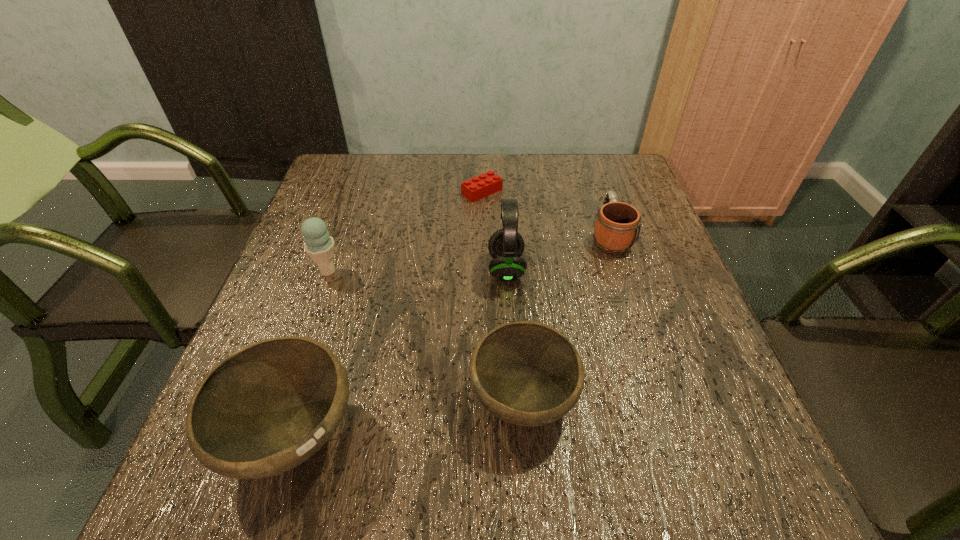
This screenshot has width=960, height=540. Find the location of `the left bowl`. the left bowl is located at coordinates (263, 410).

I want to click on the fourth tallest object, so click(x=526, y=373).

Locate an element on the screen. This screenshot has height=540, width=960. the right bowl is located at coordinates (526, 373).

The height and width of the screenshot is (540, 960). Find the location of `the shortest object`. the shortest object is located at coordinates (481, 186).

I want to click on the farthest object, so click(x=481, y=186).

The width and height of the screenshot is (960, 540). What are the coordinates of `ice cream` in the screenshot? It's located at (319, 245).

The height and width of the screenshot is (540, 960). I want to click on mug, so click(617, 226).

Identify the location of the rightmost object. The image size is (960, 540). (617, 226).

Identify the location of the tallest object. This screenshot has height=540, width=960. (506, 246).

Where is `vacant region located 0.150m on the back of the taller bowl`? vacant region located 0.150m on the back of the taller bowl is located at coordinates (331, 315).